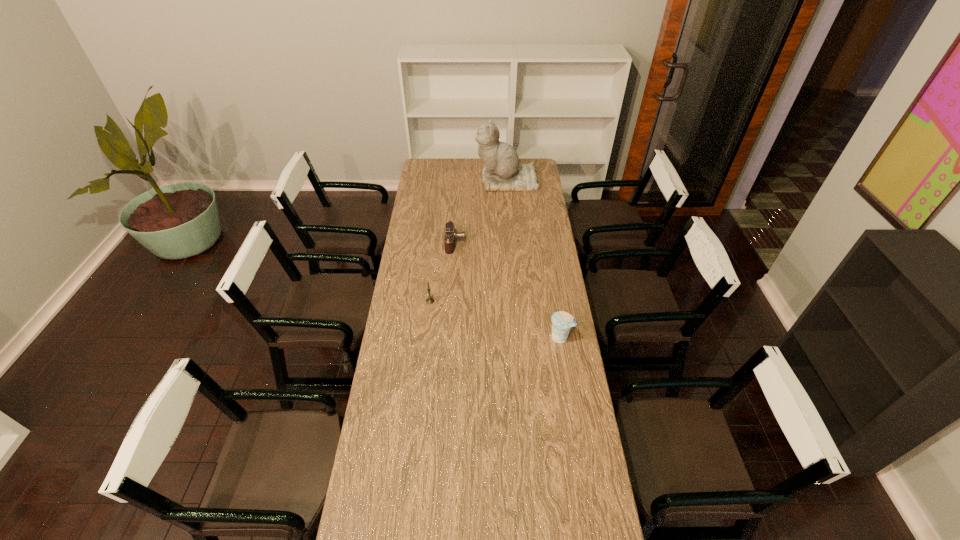
Locate an element on the screen. Image resolution: width=960 pixels, height=540 pixels. free location that satisfies the following two spatial constraints: 1. on the front-facing side of the yogurt; 2. on the left side of the third object from right to left is located at coordinates (449, 338).

This screenshot has height=540, width=960. In order to click on blank space that satisfies the following two spatial constraints: 1. on the front-facing side of the cat; 2. on the front side of the candle in this screenshot , I will do `click(516, 301)`.

You are a GUI agent. You are given a task and a screenshot of the screen. Output one action in this format:
    pyautogui.click(x=<x>, y=<y>)
    Task: Click on the vacant region that satisfies the following two spatial constraints: 1. on the front-facing side of the nearest object; 2. on the right side of the cat
    
    Given the screenshot: What is the action you would take?
    pyautogui.click(x=518, y=338)

This screenshot has width=960, height=540. In order to click on free space that satisfies the following two spatial constraints: 1. on the front-facing side of the third object from right to left; 2. on the back side of the nearest object in this screenshot , I will do `click(449, 338)`.